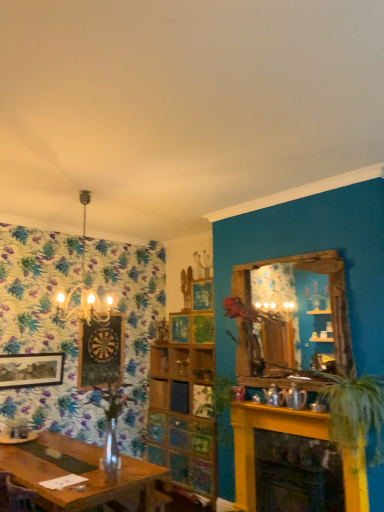
Question: In terms of width, does matte black picture frame at left, positioned as the first picture frame in left-to-right order, look wider or thinner when compared to yellow painted brick fireplace at lower right?

Choices:
 (A) thin
 (B) wide

Answer: (A)

Question: Considering the positions of matte black picture frame at left, the second picture frame in the right-to-left sequence, and yellow painted brick fireplace at lower right in the image, is matte black picture frame at left, the second picture frame in the right-to-left sequence, taller or shorter than yellow painted brick fireplace at lower right?

Choices:
 (A) tall
 (B) short

Answer: (B)

Question: Which object is positioned farthest from the matte black picture frame at left, the second picture frame in the right-to-left sequence?

Choices:
 (A) green leafy plant at center, which ranks as the second plant in right-to-left order
 (B) green leafy plant at right, which is counted as the 3th plant, starting from the left
 (C) clear glass vase at center, which is the second plant in back-to-front order
 (D) wooden dartboard at left, which is the 2th picture frame from left to right
 (E) yellow painted brick fireplace at lower right

Answer: (B)

Question: Considering the real-world distances, which object is closest to the yellow painted brick fireplace at lower right?

Choices:
 (A) green leafy plant at right, the first plant from the right
 (B) green leafy plant at center, arranged as the 2th plant when viewed from the left
 (C) matte black picture frame at left, the second picture frame in the right-to-left sequence
 (D) clear glass vase at center, which appears as the second plant when viewed from the front
 (E) gold metallic chandelier at upper left

Answer: (A)